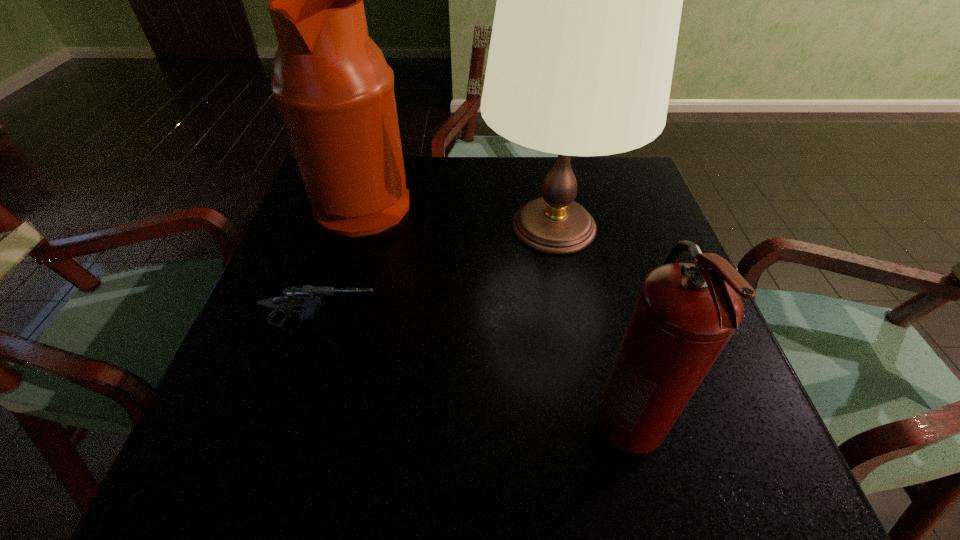
I want to click on free space at the near edge of the desktop, so click(x=340, y=442).

Identify the location of vacant space at the left edge. (342, 276).

Locate an element on the screen. The height and width of the screenshot is (540, 960). vacant space at the right edge is located at coordinates (660, 220).

I want to click on free region at the near left corner of the desktop, so click(293, 437).

You are a GUI agent. You are given a task and a screenshot of the screen. Output one action in this format:
    pyautogui.click(x=<x>, y=<y>)
    Task: Click on the free space between the lamp and the water jug
    The width and height of the screenshot is (960, 540).
    Given the screenshot: What is the action you would take?
    coord(459,214)

Find the location of a particular element. The height and width of the screenshot is (540, 960). free spot between the second shortest object and the lamp is located at coordinates click(x=589, y=326).

Find the location of a particular element. Image resolution: width=960 pixels, height=540 pixels. free space between the third tallest object and the water jug is located at coordinates [495, 313].

Where is `vacant space in between the nearest object and the lamp`? Image resolution: width=960 pixels, height=540 pixels. vacant space in between the nearest object and the lamp is located at coordinates (589, 326).

The height and width of the screenshot is (540, 960). I want to click on empty location between the gun and the fire extinguisher, so click(x=476, y=375).

You are a GUI agent. You are given a task and a screenshot of the screen. Output one action in this format:
    pyautogui.click(x=<x>, y=<y>)
    Task: Click on the free space between the fire extinguisher and the second nearest object
    This screenshot has width=960, height=540.
    Given the screenshot: What is the action you would take?
    pyautogui.click(x=476, y=375)